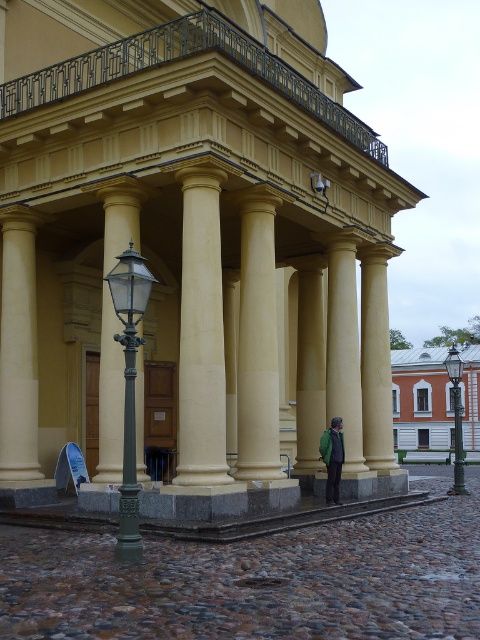
Question: Can you confirm if white marble column at left is positioned to the right of green glass lamp post at lower right?

Choices:
 (A) no
 (B) yes

Answer: (A)

Question: Which of the following is the closest to the observer?

Choices:
 (A) white marble column at left
 (B) green polished metal lamp post at left
 (C) matte yellow stone columns at center
 (D) beige marble column at center

Answer: (B)

Question: Which point appears farthest from the camera in this image?

Choices:
 (A) (319, 173)
 (B) (351, 273)
 (C) (131, 452)
 (D) (456, 472)

Answer: (D)

Question: Which object is positioned closest to the white marble column at left?

Choices:
 (A) beige marble column at center
 (B) green glass lamp post at lower right

Answer: (A)

Question: Can you confirm if smooth cream column at center is bigger than metallic streetlamp at center?

Choices:
 (A) yes
 (B) no

Answer: (A)

Question: Does white marble column at left appear over green fabric jacket at lower center?

Choices:
 (A) no
 (B) yes

Answer: (B)